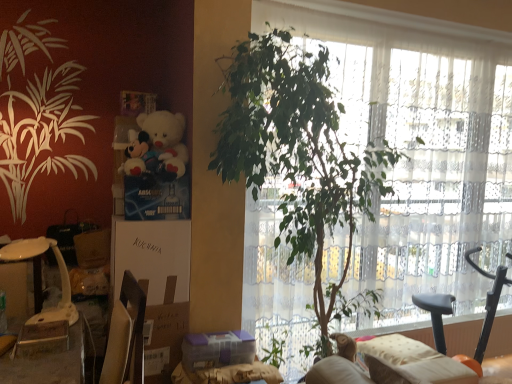
Question: Is white plastic table at lower left taller than beige fabric couch at lower right?

Choices:
 (A) yes
 (B) no

Answer: (A)

Question: Does white plastic table at lower left touch beige fabric couch at lower right?

Choices:
 (A) no
 (B) yes

Answer: (A)

Question: Is white plastic table at lower left facing away from beige fabric couch at lower right?

Choices:
 (A) yes
 (B) no

Answer: (B)

Question: Can you confirm if white plastic table at lower left is thinner than beige fabric couch at lower right?

Choices:
 (A) yes
 (B) no

Answer: (A)

Question: Considering the relative sizes of white plastic table at lower left and beige fabric couch at lower right in the image provided, is white plastic table at lower left shorter than beige fabric couch at lower right?

Choices:
 (A) no
 (B) yes

Answer: (A)

Question: Is white plastic table at lower left not close to beige fabric couch at lower right?

Choices:
 (A) no
 (B) yes

Answer: (B)

Question: From a real-world perspective, is white plush toy at upper left under brown cardboard box at lower left, placed as the 2th cardboard box when sorted from top to bottom?

Choices:
 (A) no
 (B) yes

Answer: (A)

Question: Can you confirm if white plush toy at upper left is positioned to the left of brown cardboard box at lower left, placed as the 2th cardboard box when sorted from top to bottom?

Choices:
 (A) yes
 (B) no

Answer: (B)

Question: Can you confirm if white plush toy at upper left is taller than brown cardboard box at lower left, the first cardboard box from the bottom?

Choices:
 (A) yes
 (B) no

Answer: (B)

Question: Can we say white plush toy at upper left lies outside brown cardboard box at lower left, the first cardboard box from the bottom?

Choices:
 (A) no
 (B) yes

Answer: (B)

Question: Is white plush toy at upper left wider than brown cardboard box at lower left, the first cardboard box from the bottom?

Choices:
 (A) no
 (B) yes

Answer: (B)

Question: From a real-world perspective, is white plush toy at upper left physically above brown cardboard box at lower left, placed as the 2th cardboard box when sorted from top to bottom?

Choices:
 (A) yes
 (B) no

Answer: (A)

Question: From the image's perspective, is green leafy plant at center below white plush toy at upper left?

Choices:
 (A) yes
 (B) no

Answer: (A)